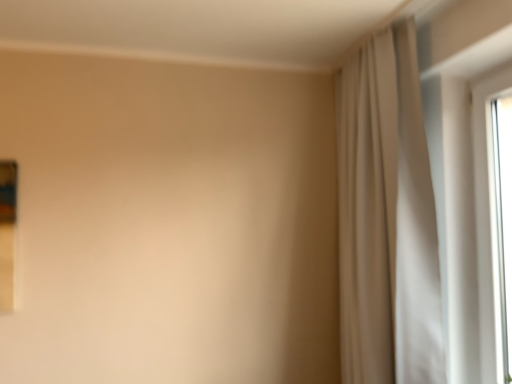
Where is `beige fabric curtain at right`? This screenshot has height=384, width=512. beige fabric curtain at right is located at coordinates (387, 218).

The width and height of the screenshot is (512, 384). What do you see at coordinates (387, 218) in the screenshot? I see `beige fabric curtain at right` at bounding box center [387, 218].

Identify the location of beige fabric curtain at right. (387, 218).